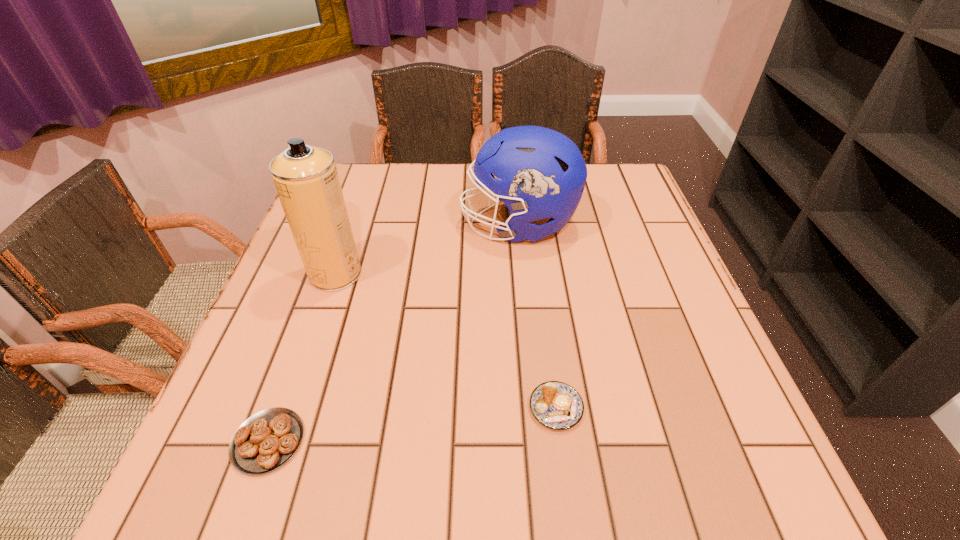
Find the location of a particular element. free space located on the back of the right pastry is located at coordinates (543, 312).

This screenshot has width=960, height=540. Find the location of `free space located 0.160m on the back of the left pastry`. free space located 0.160m on the back of the left pastry is located at coordinates click(x=306, y=334).

Locate an element on the screen. object at the far edge is located at coordinates (543, 174).

This screenshot has height=540, width=960. I want to click on object positioned at the near edge, so point(265,441).

You are a GUI agent. You are given a task and a screenshot of the screen. Output one action in this format:
    pyautogui.click(x=<x>, y=<y>)
    Task: Click on the aerosol can located at the left edge
    The width and height of the screenshot is (960, 540).
    Given the screenshot: What is the action you would take?
    pyautogui.click(x=306, y=179)

You are a GUI agent. You are given a task and a screenshot of the screen. Output one action in this format:
    pyautogui.click(x=<x>, y=<y>)
    Task: Click on the pastry present at the left edge
    This screenshot has height=540, width=960.
    Given the screenshot: What is the action you would take?
    pyautogui.click(x=265, y=441)

At what (x,y) coordinates should I click in order to perform the action: click on object located at the near left corner. Please return your answer as a coordinate pair (x, y). Looking at the image, I should click on (265, 441).

Identify the location of vacant area at the far edge of the desktop. (393, 181).

Identify the location of vacant space at the near edge of the desktop. The width and height of the screenshot is (960, 540). (422, 491).

The image size is (960, 540). I want to click on blank space at the left edge of the desktop, so click(282, 315).